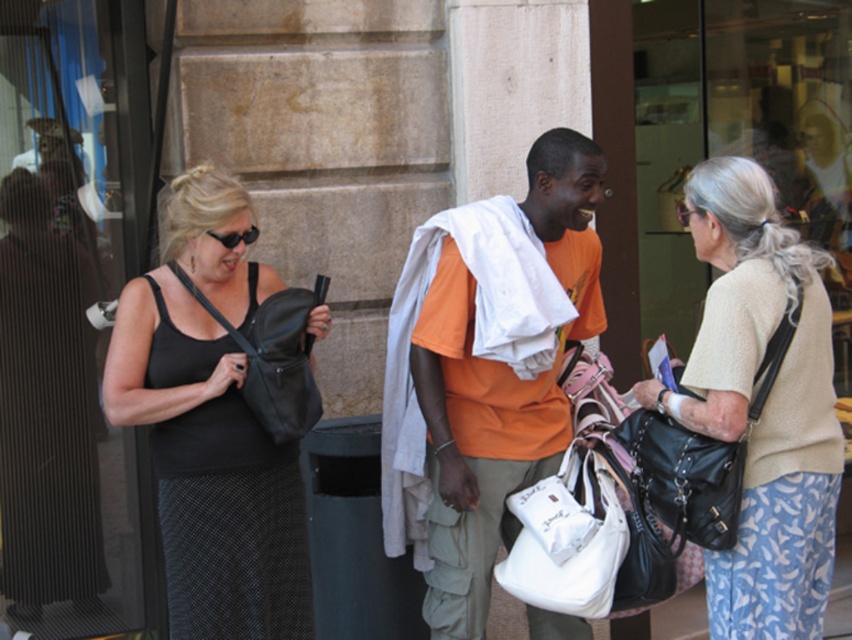
You are a photographer trying to capture a candid shot of the beige textured sweater at center and the orange cotton shirt at center. Based on their positions, which one is more to the right?

The beige textured sweater at center is more to the right than the orange cotton shirt at center.

You are a photographer trying to capture a candid shot of both the orange cotton shirt at center and the black leather bag at center. Which object should you focus on first to ensure it appears clearer in the photo?

The orange cotton shirt at center is further to the viewer than the black leather bag at center, so focusing on the orange cotton shirt at center first will ensure it appears clearer in the photo.